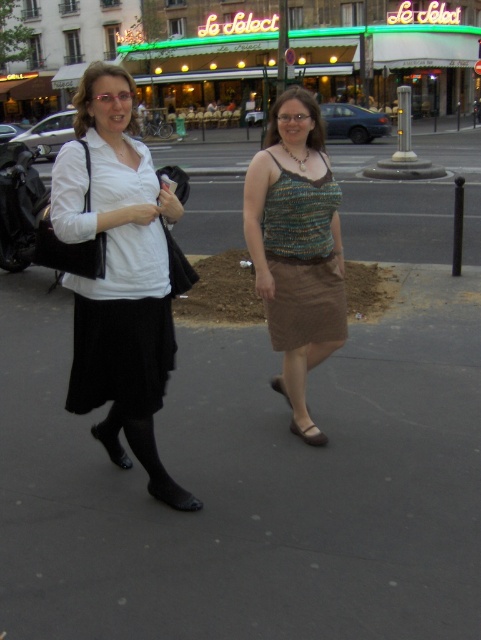
You are a fashion designer observing two women on a street. You notice the matte black skirt at left and the knitted fabric tank top at center. Which clothing item is positioned more to the left?

The matte black skirt at left is positioned more to the left than the knitted fabric tank top at center.

You are a fashion designer observing two outfits in an urban setting. The first outfit includes a matte black skirt at left, and the second features a knitted fabric dress at center. Which of these two outfits has a wider silhouette?

The knitted fabric dress at center has a wider silhouette than the matte black skirt at left because the matte black skirt at left is thinner than the knitted fabric dress at center.